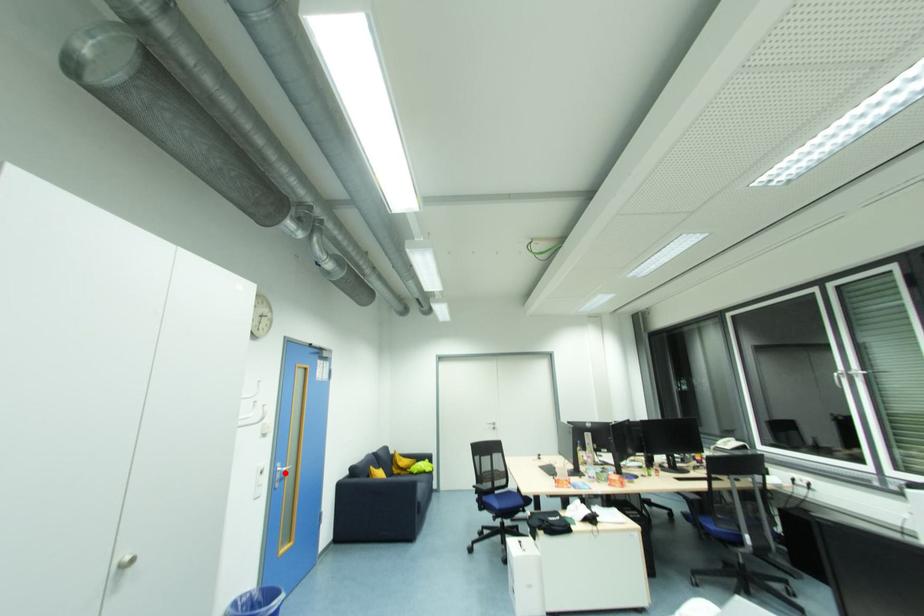
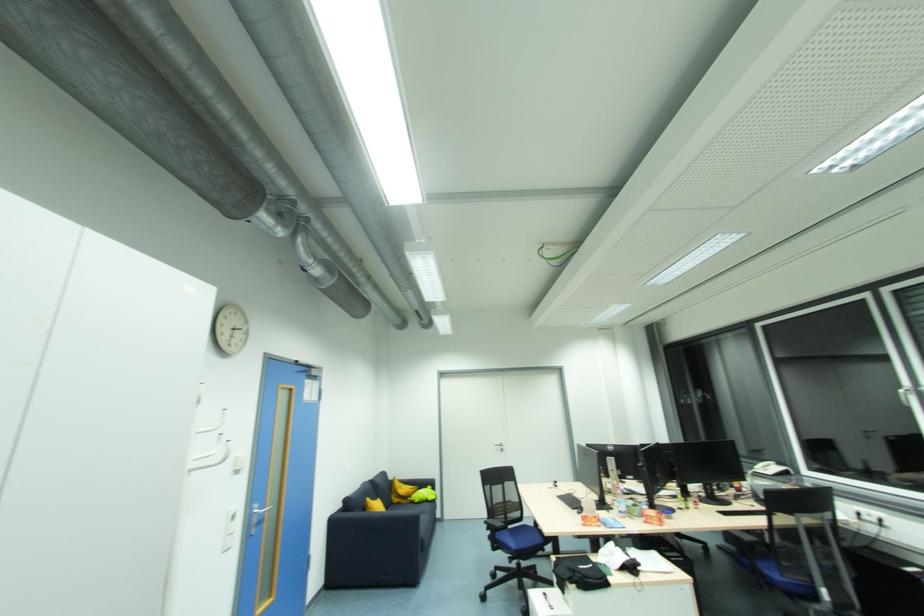
Question: I am providing you with two images of the same scene from different viewpoints. A red point is marked on the first image. Can you still see the location of the red point in image 2?

Choices:
 (A) Yes
 (B) No

Answer: (A)